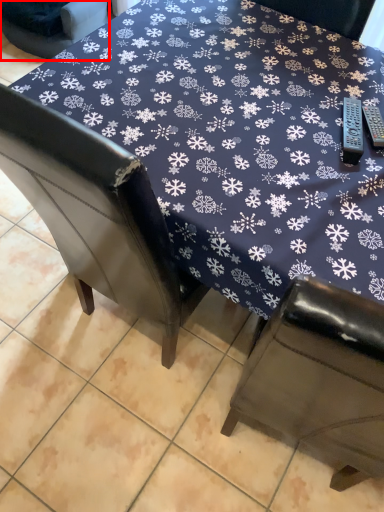
Question: From the image's perspective, considering the relative positions of chair (annotated by the red box) and table in the image provided, where is chair (annotated by the red box) located with respect to the staircase?

Choices:
 (A) above
 (B) below

Answer: (A)